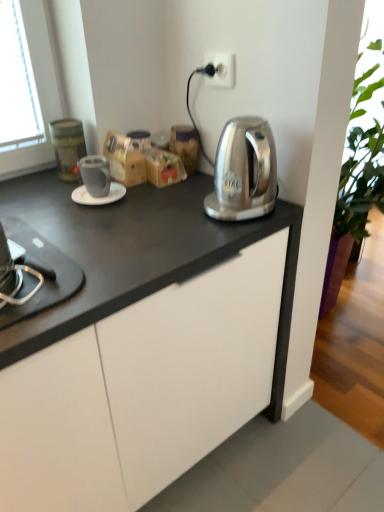
You are a GUI agent. You are given a task and a screenshot of the screen. Output one action in this format:
    pyautogui.click(x=<x>, y=<y>)
    Task: Click on the vacant space that is to the left of white glossy saucer at center
    
    Given the screenshot: What is the action you would take?
    44,198